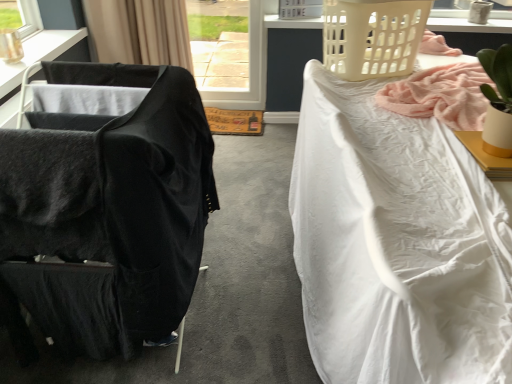
At what (x,y) coordinates should I click in order to perform the action: click on vacant space behind metallic gold lamp at upper left, the first lamp viewed from the front. Please return your answer as a coordinate pair (x, y). The height and width of the screenshot is (384, 512). Looking at the image, I should click on (28, 54).